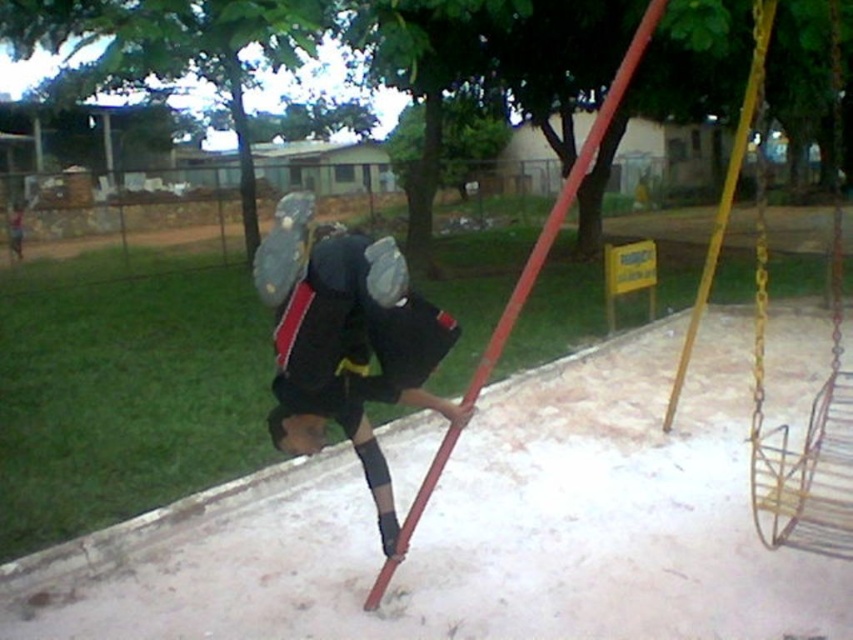
You are a park maintenance worker who needs to place a new bench that is 2 meters long between the black matte uniform at center and the metallic chain swing at right. Is there enough space to place the bench without moving either object?

The distance between the black matte uniform at center and the metallic chain swing at right is 5.36 meters. Since the bench is 2 meters long, there is sufficient space to place it between them without moving either object.

In the scene shown: You are a park visitor observing the scene. There is a black matte uniform at center and a metallic chain swing at right. Which object is located lower in the image?

The black matte uniform at center is positioned under the metallic chain swing at right, so it is located lower in the image.